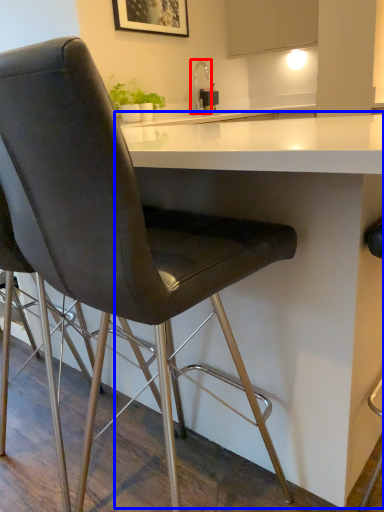
Question: Which point is further to the camera, faucet (highlighted by a red box) or table (highlighted by a blue box)?

Choices:
 (A) faucet
 (B) table

Answer: (A)